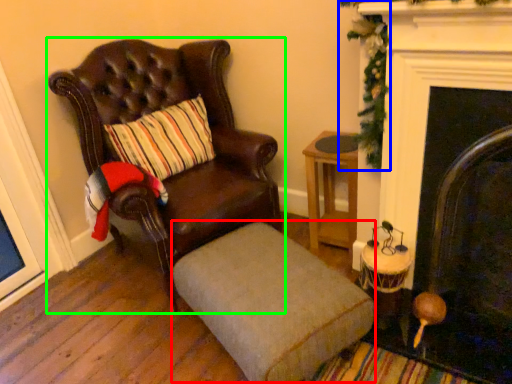
Question: Based on their relative distances, which object is nearer to footrest (highlighted by a red box)? Choose from christmas decoration (highlighted by a blue box) and chair (highlighted by a green box).

Choices:
 (A) christmas decoration
 (B) chair

Answer: (B)